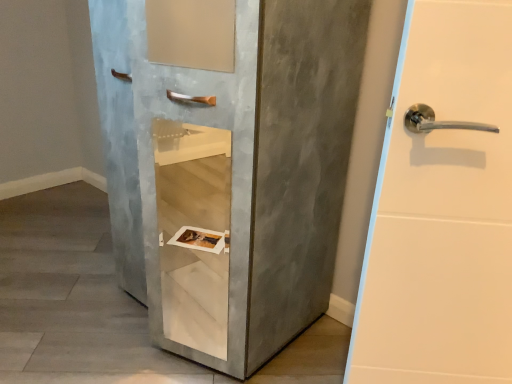
Question: Is concrete textured cabinet at center spatially inside matte gray cabinet at center, or outside of it?

Choices:
 (A) outside
 (B) inside

Answer: (A)

Question: Relative to matte gray cabinet at center, is concrete textured cabinet at center in front or behind?

Choices:
 (A) behind
 (B) front

Answer: (A)

Question: Considering the positions of concrete textured cabinet at center and matte gray cabinet at center in the image, is concrete textured cabinet at center taller or shorter than matte gray cabinet at center?

Choices:
 (A) tall
 (B) short

Answer: (B)

Question: In terms of width, does matte gray cabinet at center look wider or thinner when compared to concrete textured cabinet at center?

Choices:
 (A) wide
 (B) thin

Answer: (B)

Question: Considering the relative positions of matte gray cabinet at center and concrete textured cabinet at center in the image provided, is matte gray cabinet at center to the left or to the right of concrete textured cabinet at center?

Choices:
 (A) right
 (B) left

Answer: (A)

Question: From a real-world perspective, is matte gray cabinet at center above or below concrete textured cabinet at center?

Choices:
 (A) below
 (B) above

Answer: (B)

Question: Would you say matte gray cabinet at center is inside or outside concrete textured cabinet at center?

Choices:
 (A) inside
 (B) outside

Answer: (B)